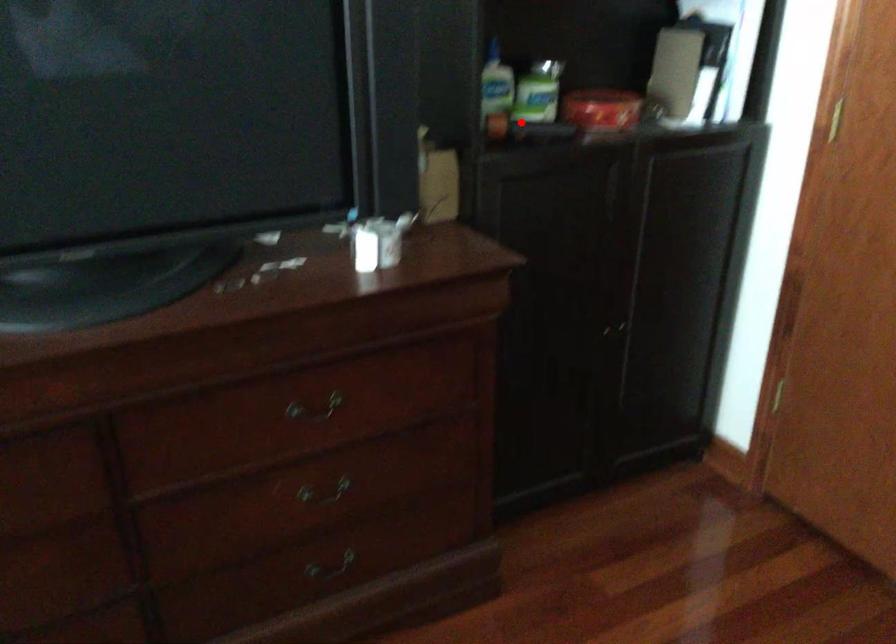
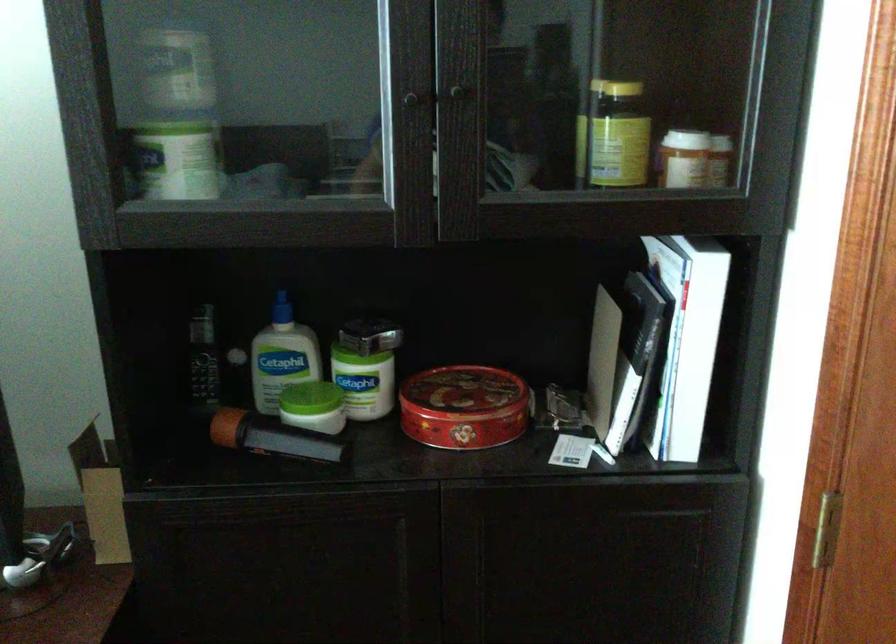
Question: I am providing you with two images of the same scene from different viewpoints. Given a red point in image1, look at the same physical point in image2. Is it:

Choices:
 (A) Closer to the viewpoint
 (B) Farther from the viewpoint

Answer: (A)